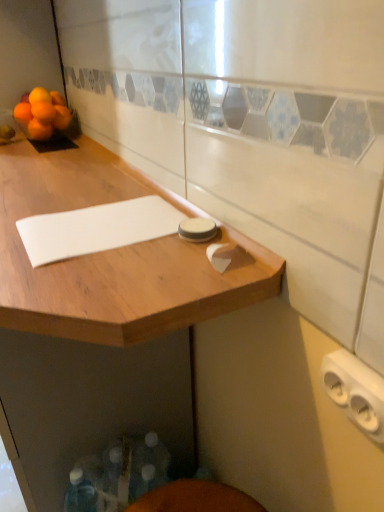
Where is `blank space situated above white matte notepad at center (from a real-world perspective)`? The height and width of the screenshot is (512, 384). blank space situated above white matte notepad at center (from a real-world perspective) is located at coordinates (99, 220).